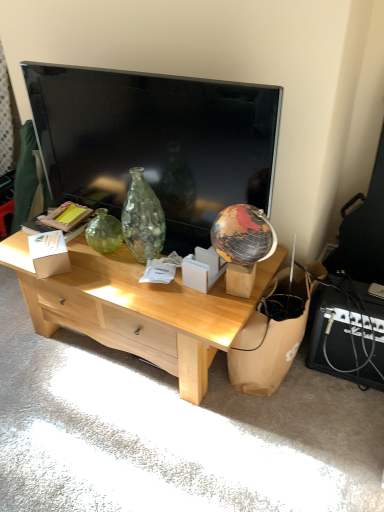
Question: Considering the relative positions of brown paper bag at lower right and light wood desk at center in the image provided, is brown paper bag at lower right to the left of light wood desk at center from the viewer's perspective?

Choices:
 (A) yes
 (B) no

Answer: (B)

Question: Does brown paper bag at lower right have a greater width compared to light wood desk at center?

Choices:
 (A) yes
 (B) no

Answer: (B)

Question: From the image's perspective, is brown paper bag at lower right below light wood desk at center?

Choices:
 (A) yes
 (B) no

Answer: (A)

Question: From a real-world perspective, is brown paper bag at lower right physically below light wood desk at center?

Choices:
 (A) no
 (B) yes

Answer: (B)

Question: Is brown paper bag at lower right further to camera compared to light wood desk at center?

Choices:
 (A) no
 (B) yes

Answer: (B)

Question: From a real-world perspective, is brown paper bag at lower right physically above light wood desk at center?

Choices:
 (A) yes
 (B) no

Answer: (B)

Question: Is light wood desk at center next to white cardboard box at center, which is the 2th cardboard box in left-to-right order?

Choices:
 (A) yes
 (B) no

Answer: (B)

Question: Can you confirm if light wood desk at center is smaller than white cardboard box at center, which is the 2th cardboard box in left-to-right order?

Choices:
 (A) no
 (B) yes

Answer: (A)

Question: Is light wood desk at center not near white cardboard box at center, which is the 2th cardboard box in left-to-right order?

Choices:
 (A) no
 (B) yes

Answer: (A)

Question: From a real-world perspective, is light wood desk at center below white cardboard box at center, which is the 2th cardboard box in left-to-right order?

Choices:
 (A) yes
 (B) no

Answer: (A)

Question: From a real-world perspective, is light wood desk at center located higher than white cardboard box at center, which is the 2th cardboard box in left-to-right order?

Choices:
 (A) no
 (B) yes

Answer: (A)

Question: Can you confirm if light wood desk at center is positioned to the right of white cardboard box at center, the first cardboard box in the right-to-left sequence?

Choices:
 (A) no
 (B) yes

Answer: (A)

Question: Can white cardboard box at center, marked as the 2th cardboard box in a right-to-left arrangement, be found inside light wood desk at center?

Choices:
 (A) yes
 (B) no

Answer: (A)